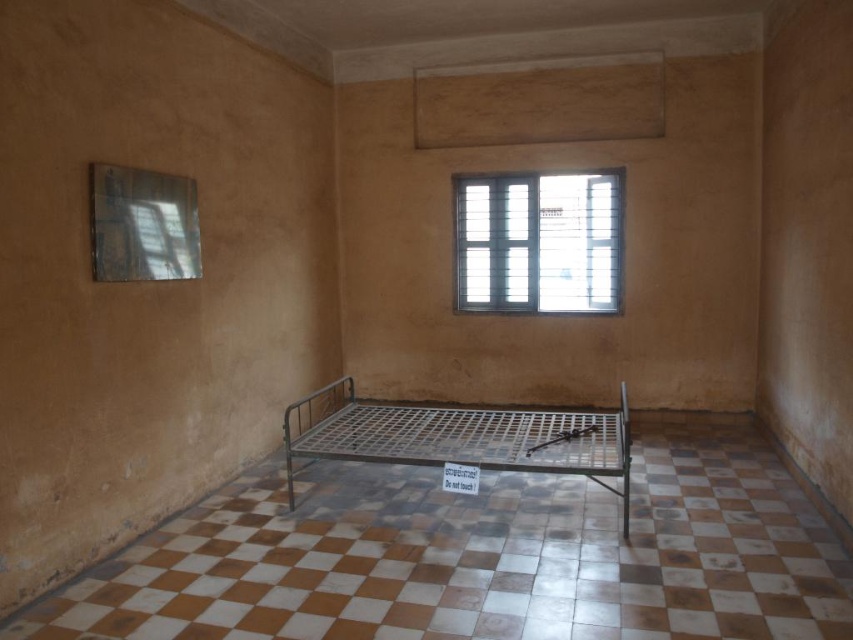
Question: Can you confirm if clear glass window at upper center is positioned below metallic grid bed at center?

Choices:
 (A) no
 (B) yes

Answer: (A)

Question: Observing the image, what is the correct spatial positioning of clear glass window at upper center in reference to metallic grid bed at center?

Choices:
 (A) left
 (B) right

Answer: (B)

Question: Which object is closer to the camera taking this photo?

Choices:
 (A) clear glass window at upper center
 (B) metallic grid bed at center

Answer: (B)

Question: Which point is closer to the camera?

Choices:
 (A) clear glass window at upper center
 (B) metallic grid bed at center

Answer: (B)

Question: Which of the following is the closest to the observer?

Choices:
 (A) metallic grid bed at center
 (B) clear glass window at upper center

Answer: (A)

Question: Is clear glass window at upper center to the right of metallic grid bed at center from the viewer's perspective?

Choices:
 (A) no
 (B) yes

Answer: (B)